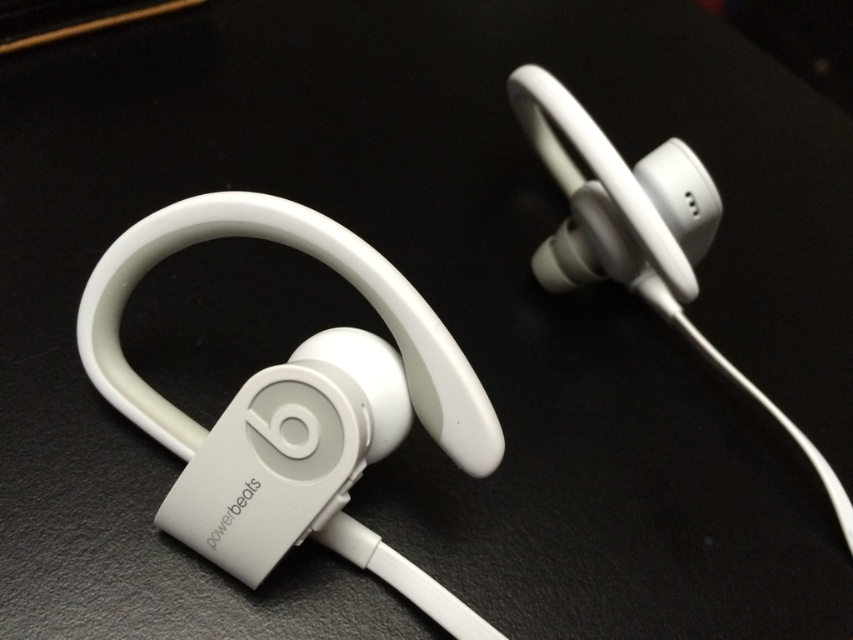
Question: Is white matte earphone at center positioned behind white matte earphone at upper center?

Choices:
 (A) yes
 (B) no

Answer: (A)

Question: Which point is farther to the camera?

Choices:
 (A) (547, 243)
 (B) (635, 220)

Answer: (A)

Question: Can you confirm if white matte earphone at center is positioned above white matte earphone at upper center?

Choices:
 (A) no
 (B) yes

Answer: (B)

Question: Can you confirm if white matte earphone at center is positioned above white matte earphone at upper center?

Choices:
 (A) yes
 (B) no

Answer: (A)

Question: Among these points, which one is farthest from the camera?

Choices:
 (A) (639, 240)
 (B) (685, 176)

Answer: (B)

Question: Which point is closer to the camera taking this photo?

Choices:
 (A) (537, 120)
 (B) (558, 268)

Answer: (B)